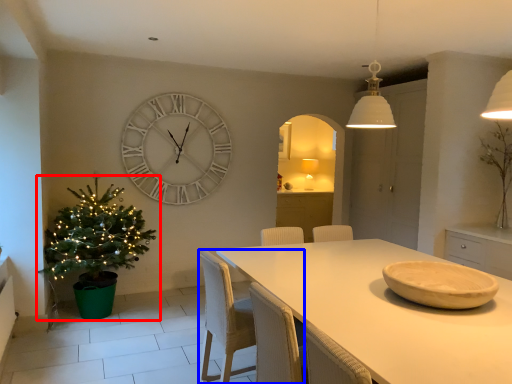
Question: Which object is closer to the camera taking this photo, houseplant (highlighted by a red box) or chair (highlighted by a blue box)?

Choices:
 (A) houseplant
 (B) chair

Answer: (B)